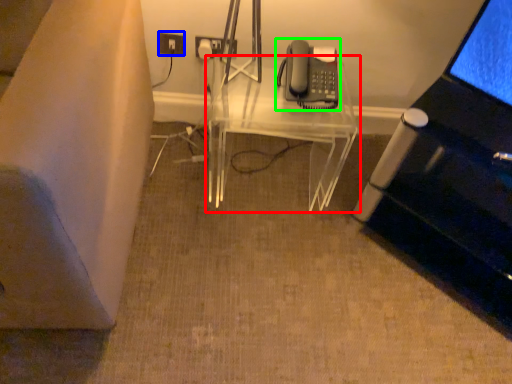
Question: Based on their relative distances, which object is farther from table (highlighted by a red box)? Choose from electric outlet (highlighted by a blue box) and corded phone (highlighted by a green box).

Choices:
 (A) electric outlet
 (B) corded phone

Answer: (A)